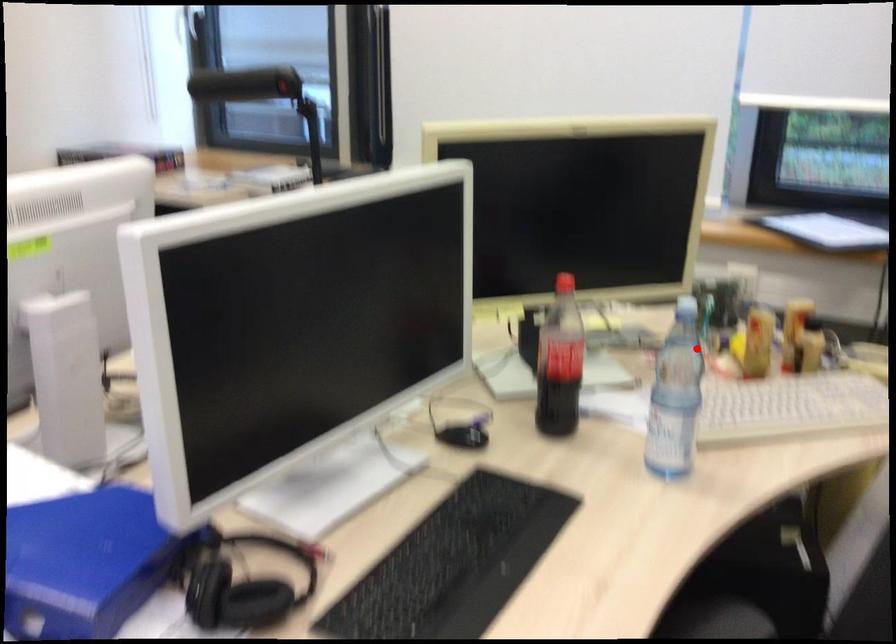
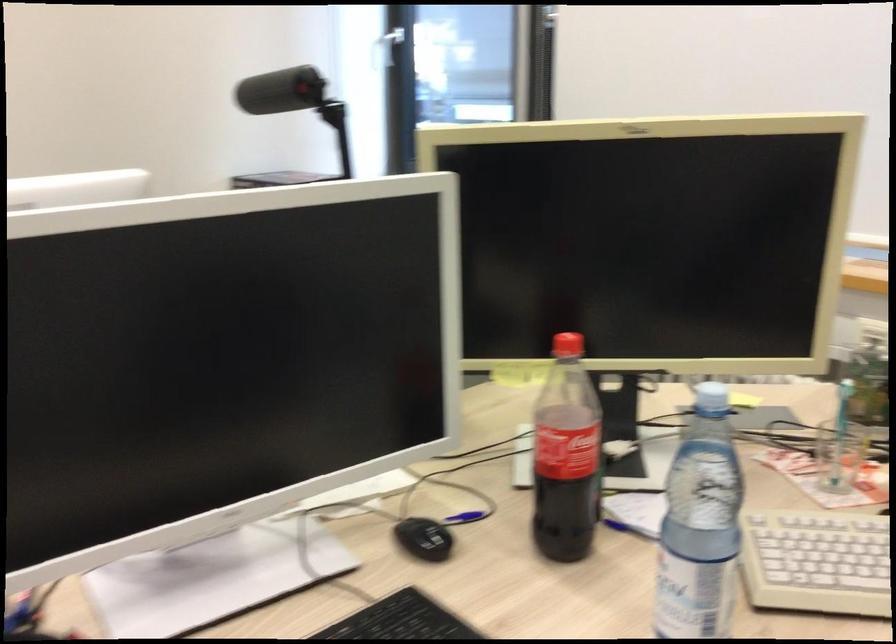
Locate, in the second image, the point that corresponds to the highlighted location in the first image.

(839, 456)